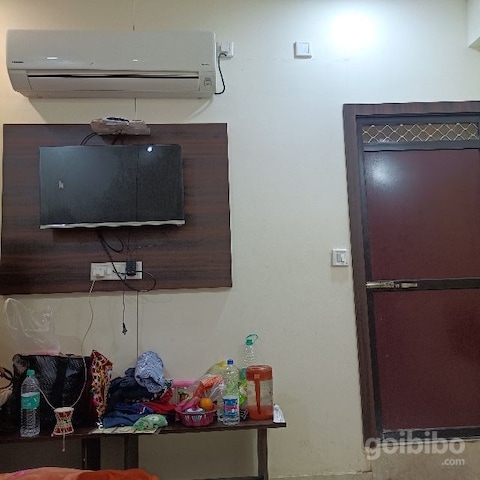
At what (x,y) coordinates should I click in order to perform the action: click on space under table. Please return your answer as a coordinate pair (x, y). The height and width of the screenshot is (480, 480). Looking at the image, I should click on (204, 456).